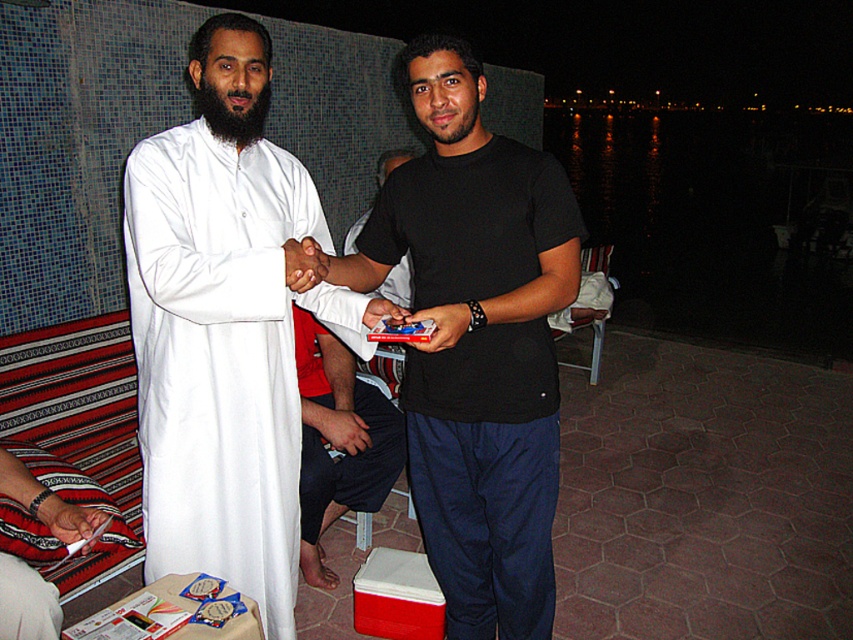
Question: Which point appears closest to the camera in this image?

Choices:
 (A) (169, 376)
 (B) (358, 451)
 (C) (428, 314)

Answer: (C)

Question: Estimate the real-world distances between objects in this image. Which object is closer to the dark blue cotton pants at center?

Choices:
 (A) white fabric hand at lower left
 (B) white matte robe at center

Answer: (B)

Question: From the image, what is the correct spatial relationship of white fabric hand at lower left in relation to white matte paper at lower left?

Choices:
 (A) left
 (B) right

Answer: (A)

Question: Can you confirm if white fabric hand at lower left is positioned to the left of matte plastic phone at center?

Choices:
 (A) no
 (B) yes

Answer: (B)

Question: Does white matte robe at center have a greater width compared to smooth skin hand at center?

Choices:
 (A) yes
 (B) no

Answer: (A)

Question: Which object is the closest to the white matte paper at lower left?

Choices:
 (A) dark blue cotton pants at center
 (B) white fabric hand at lower left

Answer: (B)